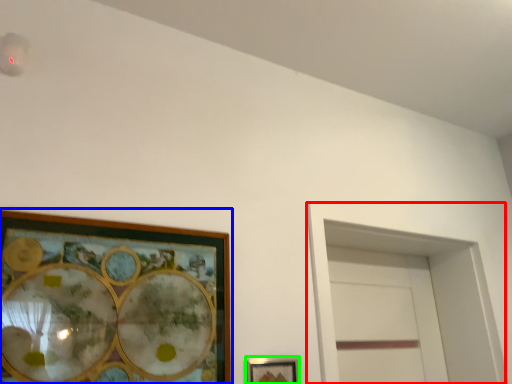
Question: Which is nearer to the glass door (highlighted by a red box)? picture frame (highlighted by a blue box) or picture frame (highlighted by a green box).

Choices:
 (A) picture frame
 (B) picture frame

Answer: (B)